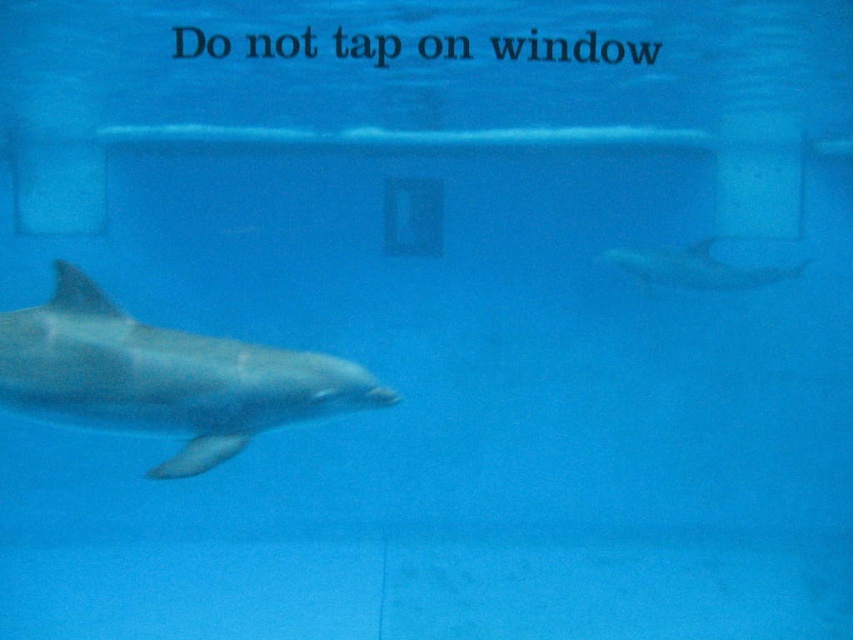
Does smooth gray dolphin at left lie behind smooth gray dolphin at upper right?

No, smooth gray dolphin at left is in front of smooth gray dolphin at upper right.

The width and height of the screenshot is (853, 640). In order to click on smooth gray dolphin at left in this screenshot , I will do (x=163, y=378).

Where is `smooth gray dolphin at left`? smooth gray dolphin at left is located at coordinates (163, 378).